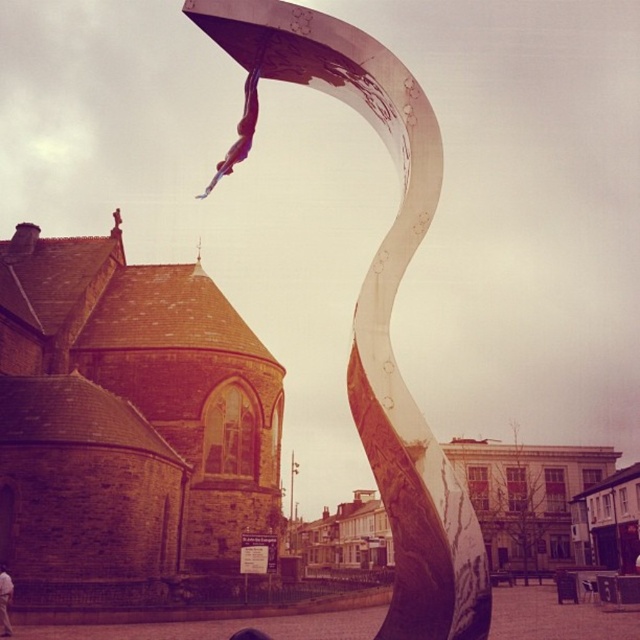
Question: Does metallic polished sculpture at center have a lesser width compared to white cotton shirt at lower left?

Choices:
 (A) yes
 (B) no

Answer: (B)

Question: Does metallic polished sculpture at center lie behind white cotton shirt at lower left?

Choices:
 (A) yes
 (B) no

Answer: (B)

Question: Which object is farther from the camera taking this photo?

Choices:
 (A) metallic polished sculpture at center
 (B) white cotton shirt at lower left

Answer: (B)

Question: Where is metallic polished sculpture at center located in relation to white cotton shirt at lower left in the image?

Choices:
 (A) below
 (B) above

Answer: (B)